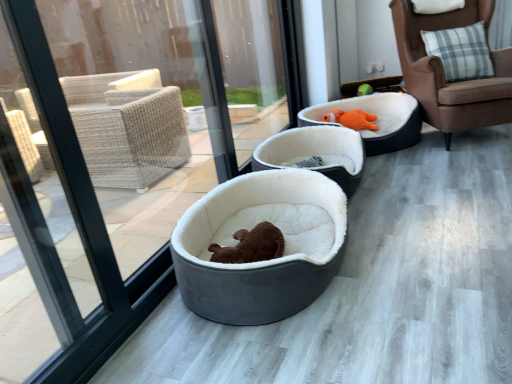
Question: Does brown leather chair at right have a greater width compared to orange plush toy at upper right?

Choices:
 (A) yes
 (B) no

Answer: (A)

Question: From a real-world perspective, does brown leather chair at right sit lower than orange plush toy at upper right?

Choices:
 (A) yes
 (B) no

Answer: (B)

Question: Is the position of brown leather chair at right less distant than that of orange plush toy at upper right?

Choices:
 (A) yes
 (B) no

Answer: (A)

Question: From the image's perspective, would you say brown leather chair at right is positioned over orange plush toy at upper right?

Choices:
 (A) no
 (B) yes

Answer: (B)

Question: Can you confirm if brown leather chair at right is bigger than orange plush toy at upper right?

Choices:
 (A) yes
 (B) no

Answer: (A)

Question: Considering the positions of orange plush toy at upper right and soft white fur bed at center, acting as the second dog bed starting from the front, in the image, is orange plush toy at upper right taller or shorter than soft white fur bed at center, acting as the second dog bed starting from the front,?

Choices:
 (A) short
 (B) tall

Answer: (A)

Question: Considering the positions of orange plush toy at upper right and soft white fur bed at center, acting as the second dog bed starting from the front, in the image, is orange plush toy at upper right bigger or smaller than soft white fur bed at center, acting as the second dog bed starting from the front,?

Choices:
 (A) big
 (B) small

Answer: (B)

Question: Based on their positions, is orange plush toy at upper right located to the left or right of soft white fur bed at center, acting as the second dog bed starting from the front?

Choices:
 (A) left
 (B) right

Answer: (B)

Question: In terms of width, does orange plush toy at upper right look wider or thinner when compared to soft white fur bed at center, acting as the second dog bed starting from the front?

Choices:
 (A) thin
 (B) wide

Answer: (A)

Question: Considering the relative positions of soft white fur bed at center, positioned as the 2th dog bed in back-to-front order, and brown leather chair at right in the image provided, is soft white fur bed at center, positioned as the 2th dog bed in back-to-front order, to the left or to the right of brown leather chair at right?

Choices:
 (A) left
 (B) right

Answer: (A)

Question: From a real-world perspective, is soft white fur bed at center, positioned as the 2th dog bed in back-to-front order, physically located above or below brown leather chair at right?

Choices:
 (A) below
 (B) above

Answer: (A)

Question: From the image's perspective, is soft white fur bed at center, positioned as the 2th dog bed in back-to-front order, positioned above or below brown leather chair at right?

Choices:
 (A) above
 (B) below

Answer: (B)

Question: Is point (311, 140) positioned closer to the camera than point (509, 99)?

Choices:
 (A) closer
 (B) farther

Answer: (B)

Question: From a real-world perspective, is soft white fur bed at center, positioned as the 2th dog bed in back-to-front order, above or below velvet orange plush bed at center, acting as the 1th dog bed starting from the back?

Choices:
 (A) below
 (B) above

Answer: (A)

Question: Relative to velvet orange plush bed at center, which is the third dog bed in front-to-back order, is soft white fur bed at center, positioned as the 2th dog bed in back-to-front order, in front or behind?

Choices:
 (A) behind
 (B) front

Answer: (B)